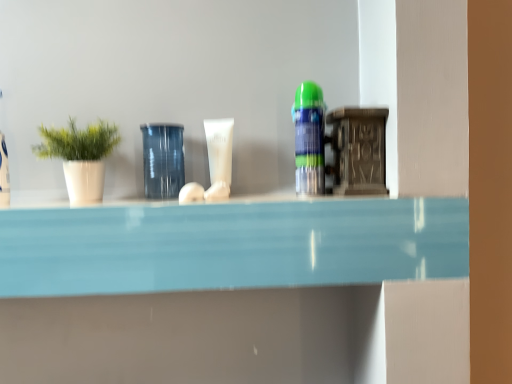
Question: From the image's perspective, is transparent glass jar at center beneath white matte pot at left?

Choices:
 (A) yes
 (B) no

Answer: (B)

Question: Considering the relative sizes of transparent glass jar at center and white matte pot at left in the image provided, is transparent glass jar at center taller than white matte pot at left?

Choices:
 (A) no
 (B) yes

Answer: (B)

Question: Is transparent glass jar at center to the left of white matte pot at left from the viewer's perspective?

Choices:
 (A) yes
 (B) no

Answer: (B)

Question: Considering the relative sizes of transparent glass jar at center and white matte pot at left in the image provided, is transparent glass jar at center bigger than white matte pot at left?

Choices:
 (A) no
 (B) yes

Answer: (A)

Question: From the image's perspective, is transparent glass jar at center above white matte pot at left?

Choices:
 (A) yes
 (B) no

Answer: (A)

Question: Would you say transparent glass jar at center is to the left or to the right of white matte pot at left in the picture?

Choices:
 (A) right
 (B) left

Answer: (A)

Question: From the image's perspective, is transparent glass jar at center above or below white matte pot at left?

Choices:
 (A) above
 (B) below

Answer: (A)

Question: In the image, is transparent glass jar at center positioned in front of or behind white matte pot at left?

Choices:
 (A) behind
 (B) front

Answer: (A)

Question: From a real-world perspective, is transparent glass jar at center physically located above or below white matte pot at left?

Choices:
 (A) above
 (B) below

Answer: (B)

Question: From the image's perspective, relative to white matte tube at center, the first toiletry positioned from the back, is transparent glass jar at center above or below?

Choices:
 (A) above
 (B) below

Answer: (B)

Question: In terms of width, does transparent glass jar at center look wider or thinner when compared to white matte tube at center, arranged as the 2th toiletry when viewed from the front?

Choices:
 (A) wide
 (B) thin

Answer: (A)

Question: From a real-world perspective, is transparent glass jar at center positioned above or below white matte tube at center, the 1th toiletry when ordered from left to right?

Choices:
 (A) below
 (B) above

Answer: (A)

Question: Is transparent glass jar at center inside or outside of white matte tube at center, arranged as the 2th toiletry when viewed from the right?

Choices:
 (A) inside
 (B) outside

Answer: (B)

Question: Considering the positions of white matte tube at center, the first toiletry positioned from the back, and translucent plastic spray can at center, which appears as the first toiletry when viewed from the right, in the image, is white matte tube at center, the first toiletry positioned from the back, wider or thinner than translucent plastic spray can at center, which appears as the first toiletry when viewed from the right,?

Choices:
 (A) thin
 (B) wide

Answer: (A)

Question: From a real-world perspective, is white matte tube at center, arranged as the 2th toiletry when viewed from the front, positioned above or below translucent plastic spray can at center, the 2th toiletry viewed from the back?

Choices:
 (A) below
 (B) above

Answer: (A)